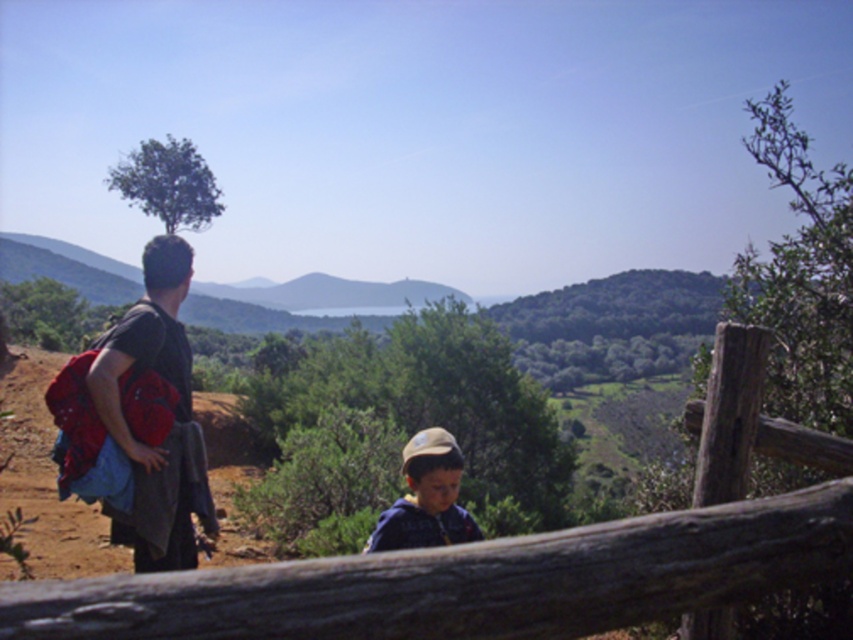
You are planning to place a matte black backpack at left on top of the wooden log at center. Will the backpack fit entirely on the log without hanging over the edges?

The wooden log at center is wider than the matte black backpack at left, so the backpack will fit entirely on the log without hanging over the edges.

You are standing at the center of the image and want to locate the matte black backpack at left. According to the coordinates provided, in which direction should you look to find it?

The matte black backpack at left is located at coordinates point (161, 378), so you should look to the left side of the image to find it.

Based on the scene description, where is the wooden log at center located in the image?

The wooden log at center is located at point (469, 580).